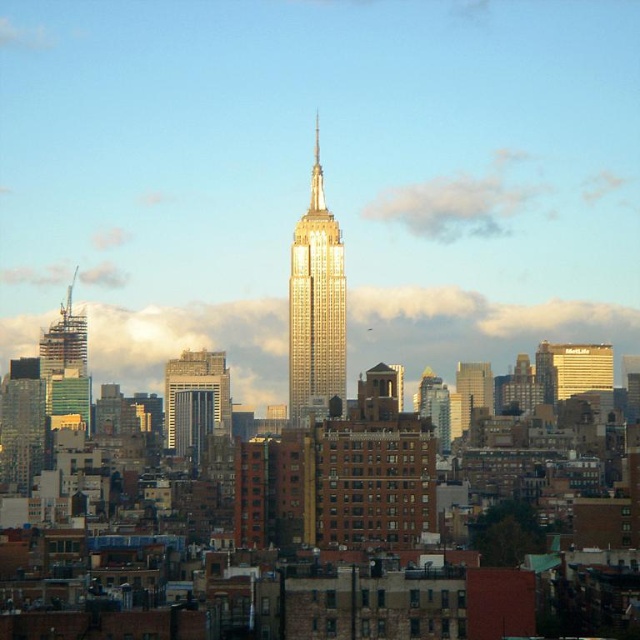
What is the color and material of the building located at the coordinates point (196, 388) in the city skyline image?

The building at point (196, 388) is a gray concrete skyscraper.

You are standing at point (316, 305) in the city skyline image. What do you see directly in front of you?

You see the shiny gold skyscraper at center directly in front of you at point (316, 305).

You are a photographer wanting to capture the Empire State Building and the cloudy sky in the same frame. Based on the scene, which object is positioned closer to you, the cloudy sky at center or the glassy reflective skyscraper at center?

The cloudy sky at center is closer to the viewer than the glassy reflective skyscraper at center.